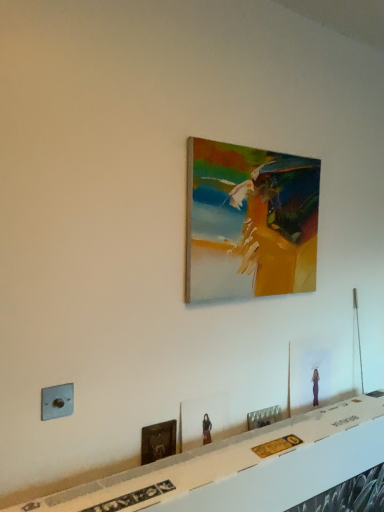
Measure the distance between matte glass picture frame at lower right, positioned as the 4th picture frame in bottom-to-top order, and camera.

They are 1.70 meters apart.

Locate an element on the screen. matte glass picture frame at lower right, positioned as the 4th picture frame in bottom-to-top order is located at coordinates (308, 375).

Describe the element at coordinates (158, 441) in the screenshot. I see `wooden picture frame at lower left, positioned as the fourth picture frame in top-to-bottom order` at that location.

Locate an element on the screen. The width and height of the screenshot is (384, 512). matte glass picture frame at lower right, which is counted as the second picture frame, starting from the top is located at coordinates (308, 375).

At what (x,y) coordinates should I click in order to perform the action: click on electric outlet that is in front of the wooden picture frame at lower left, which appears as the second picture frame when ordered from the bottom. Please return your answer as a coordinate pair (x, y). This screenshot has height=512, width=384. Looking at the image, I should click on (57, 401).

From a real-world perspective, is wooden picture frame at lower left, positioned as the fourth picture frame in top-to-bottom order, positioned under metallic gray electric outlet at lower left based on gravity?

Yes, from a real-world perspective, wooden picture frame at lower left, positioned as the fourth picture frame in top-to-bottom order, is under metallic gray electric outlet at lower left.

Consider the image. Is wooden picture frame at lower left, positioned as the fourth picture frame in top-to-bottom order, oriented away from metallic gray electric outlet at lower left?

No.

Looking at this image, which object is wider, wooden picture frame at lower left, positioned as the fourth picture frame in top-to-bottom order, or metallic gray electric outlet at lower left?

metallic gray electric outlet at lower left.

From a real-world perspective, does metallic silver picture frame at lower center, which is counted as the 1th picture frame, starting from the bottom, sit lower than white glossy table at lower center?

Actually, metallic silver picture frame at lower center, which is counted as the 1th picture frame, starting from the bottom, is physically above white glossy table at lower center in the real world.

Looking at this image, is metallic silver picture frame at lower center, which is counted as the 5th picture frame, starting from the top, at the left side of white glossy table at lower center?

Incorrect, metallic silver picture frame at lower center, which is counted as the 5th picture frame, starting from the top, is not on the left side of white glossy table at lower center.

Is metallic silver picture frame at lower center, which is counted as the 5th picture frame, starting from the top, smaller than white glossy table at lower center?

Indeed, metallic silver picture frame at lower center, which is counted as the 5th picture frame, starting from the top, has a smaller size compared to white glossy table at lower center.

From the image's perspective, count 1st picture frames upward from the white glossy table at lower center and point to it. Please provide its 2D coordinates.

[(263, 417)]

Can you tell me how much wooden painting at center, arranged as the 5th picture frame when ordered from the bottom, and white glossy table at lower center differ in facing direction?

The angle between the facing direction of wooden painting at center, arranged as the 5th picture frame when ordered from the bottom, and the facing direction of white glossy table at lower center is 0.15 degrees.

Is wooden painting at center, arranged as the 5th picture frame when ordered from the bottom, touching white glossy table at lower center?

No, wooden painting at center, arranged as the 5th picture frame when ordered from the bottom, is not making contact with white glossy table at lower center.

Is wooden painting at center, the first picture frame viewed from the top, in front of or behind white glossy table at lower center in the image?

wooden painting at center, the first picture frame viewed from the top, is behind white glossy table at lower center.

Is white glossy table at lower center at the back of wooden painting at center, arranged as the 5th picture frame when ordered from the bottom?

No, wooden painting at center, arranged as the 5th picture frame when ordered from the bottom, is not facing the opposite direction of white glossy table at lower center.

Measure the distance from wooden picture frame at lower left, which appears as the second picture frame when ordered from the bottom, to wooden painting at center, arranged as the 5th picture frame when ordered from the bottom.

wooden picture frame at lower left, which appears as the second picture frame when ordered from the bottom, and wooden painting at center, arranged as the 5th picture frame when ordered from the bottom, are 70.75 centimeters apart from each other.

Is point (172, 449) positioned after point (303, 177)?

No.

From the image's perspective, is wooden picture frame at lower left, which appears as the second picture frame when ordered from the bottom, above or below wooden painting at center, the first picture frame viewed from the top?

Based on their image positions, wooden picture frame at lower left, which appears as the second picture frame when ordered from the bottom, is located beneath wooden painting at center, the first picture frame viewed from the top.

From a real-world perspective, between white glossy table at lower center and matte wooden picture frame at center, marked as the third picture frame in a top-to-bottom arrangement, who is vertically higher?

matte wooden picture frame at center, marked as the third picture frame in a top-to-bottom arrangement, is physically above.

Relative to matte wooden picture frame at center, marked as the third picture frame in a top-to-bottom arrangement, is white glossy table at lower center in front or behind?

In the image, white glossy table at lower center appears in front of matte wooden picture frame at center, marked as the third picture frame in a top-to-bottom arrangement.

Could you tell me if white glossy table at lower center is turned towards matte wooden picture frame at center, marked as the third picture frame in a top-to-bottom arrangement?

No, white glossy table at lower center is not turned towards matte wooden picture frame at center, marked as the third picture frame in a top-to-bottom arrangement.

How far apart are white glossy table at lower center and matte wooden picture frame at center, the third picture frame in the bottom-to-top sequence?

They are 11.68 inches apart.

From a real-world perspective, is matte wooden picture frame at center, marked as the third picture frame in a top-to-bottom arrangement, positioned under wooden painting at center, arranged as the 5th picture frame when ordered from the bottom, based on gravity?

Yes.

From the image's perspective, does matte wooden picture frame at center, marked as the third picture frame in a top-to-bottom arrangement, appear higher than wooden painting at center, the first picture frame viewed from the top?

No, from the image's perspective, matte wooden picture frame at center, marked as the third picture frame in a top-to-bottom arrangement, is not over wooden painting at center, the first picture frame viewed from the top.

Considering the sizes of objects matte wooden picture frame at center, the third picture frame in the bottom-to-top sequence, and wooden painting at center, the first picture frame viewed from the top, in the image provided, who is shorter, matte wooden picture frame at center, the third picture frame in the bottom-to-top sequence, or wooden painting at center, the first picture frame viewed from the top,?

matte wooden picture frame at center, the third picture frame in the bottom-to-top sequence, is shorter.

Is metallic gray electric outlet at lower left inside the boundaries of wooden picture frame at lower left, which appears as the second picture frame when ordered from the bottom, or outside?

The correct answer is: outside.

Is metallic gray electric outlet at lower left in contact with wooden picture frame at lower left, positioned as the fourth picture frame in top-to-bottom order?

No, metallic gray electric outlet at lower left is not making contact with wooden picture frame at lower left, positioned as the fourth picture frame in top-to-bottom order.

Locate an element on the screen. electric outlet on the left of wooden picture frame at lower left, which appears as the second picture frame when ordered from the bottom is located at coordinates [x=57, y=401].

Based on their positions, is metallic gray electric outlet at lower left located to the left or right of wooden picture frame at lower left, positioned as the fourth picture frame in top-to-bottom order?

Based on their positions, metallic gray electric outlet at lower left is located to the left of wooden picture frame at lower left, positioned as the fourth picture frame in top-to-bottom order.

Locate an element on the screen. electric outlet located above the wooden picture frame at lower left, which appears as the second picture frame when ordered from the bottom (from a real-world perspective) is located at coordinates (57, 401).

Locate an element on the screen. Image resolution: width=384 pixels, height=512 pixels. the 2nd picture frame to the right of the white glossy table at lower center, starting your count from the anchor is located at coordinates (263, 417).

Based on the photo, looking at the image, which one is located closer to matte wooden picture frame at center, marked as the third picture frame in a top-to-bottom arrangement, matte glass picture frame at lower right, which is counted as the second picture frame, starting from the top, or white glossy table at lower center?

Based on the image, white glossy table at lower center appears to be nearer to matte wooden picture frame at center, marked as the third picture frame in a top-to-bottom arrangement.

Based on their spatial positions, is wooden painting at center, arranged as the 5th picture frame when ordered from the bottom, or wooden picture frame at lower left, which appears as the second picture frame when ordered from the bottom, closer to white glossy table at lower center?

Among the two, wooden picture frame at lower left, which appears as the second picture frame when ordered from the bottom, is located nearer to white glossy table at lower center.

When comparing their distances from wooden picture frame at lower left, positioned as the fourth picture frame in top-to-bottom order, does wooden painting at center, arranged as the 5th picture frame when ordered from the bottom, or matte wooden picture frame at center, marked as the third picture frame in a top-to-bottom arrangement, seem further?

wooden painting at center, arranged as the 5th picture frame when ordered from the bottom, is positioned further to the anchor wooden picture frame at lower left, positioned as the fourth picture frame in top-to-bottom order.

Based on their spatial positions, is wooden picture frame at lower left, which appears as the second picture frame when ordered from the bottom, or matte wooden picture frame at center, marked as the third picture frame in a top-to-bottom arrangement, further from metallic silver picture frame at lower center, which is counted as the 5th picture frame, starting from the top?

wooden picture frame at lower left, which appears as the second picture frame when ordered from the bottom.

From the image, which object appears to be nearer to white glossy table at lower center, metallic gray electric outlet at lower left or metallic silver picture frame at lower center, which is counted as the 1th picture frame, starting from the bottom?

metallic silver picture frame at lower center, which is counted as the 1th picture frame, starting from the bottom, lies closer to white glossy table at lower center than the other object.

In the scene shown: Looking at the image, which one is located further to white glossy table at lower center, matte glass picture frame at lower right, positioned as the 4th picture frame in bottom-to-top order, or matte wooden picture frame at center, the third picture frame in the bottom-to-top sequence?

matte glass picture frame at lower right, positioned as the 4th picture frame in bottom-to-top order, is further to white glossy table at lower center.

Estimate the real-world distances between objects in this image. Which object is further from wooden painting at center, arranged as the 5th picture frame when ordered from the bottom, matte wooden picture frame at center, the third picture frame in the bottom-to-top sequence, or metallic gray electric outlet at lower left?

metallic gray electric outlet at lower left.

Looking at the image, which one is located closer to wooden picture frame at lower left, positioned as the fourth picture frame in top-to-bottom order, metallic silver picture frame at lower center, which is counted as the 1th picture frame, starting from the bottom, or matte glass picture frame at lower right, positioned as the 4th picture frame in bottom-to-top order?

metallic silver picture frame at lower center, which is counted as the 1th picture frame, starting from the bottom, lies closer to wooden picture frame at lower left, positioned as the fourth picture frame in top-to-bottom order, than the other object.

Locate an element on the screen. This screenshot has width=384, height=512. electric outlet between wooden painting at center, the first picture frame viewed from the top, and matte wooden picture frame at center, the third picture frame in the bottom-to-top sequence, in the up-down direction is located at coordinates (x=57, y=401).

This screenshot has width=384, height=512. I want to click on picture frame between wooden painting at center, arranged as the 5th picture frame when ordered from the bottom, and matte wooden picture frame at center, marked as the third picture frame in a top-to-bottom arrangement, in the vertical direction, so click(308, 375).

Where is `electric outlet between white glossy table at lower center and metallic silver picture frame at lower center, which is counted as the 5th picture frame, starting from the top, from front to back`? Image resolution: width=384 pixels, height=512 pixels. electric outlet between white glossy table at lower center and metallic silver picture frame at lower center, which is counted as the 5th picture frame, starting from the top, from front to back is located at coordinates (57, 401).

I want to click on electric outlet between wooden painting at center, arranged as the 5th picture frame when ordered from the bottom, and white glossy table at lower center, in the vertical direction, so click(57, 401).